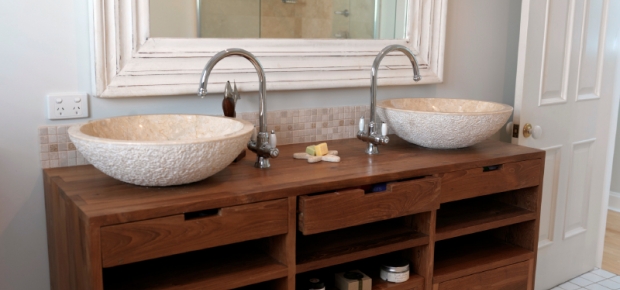
The image size is (620, 290). I want to click on silver gray curved faucets, so click(376, 58), click(246, 56).